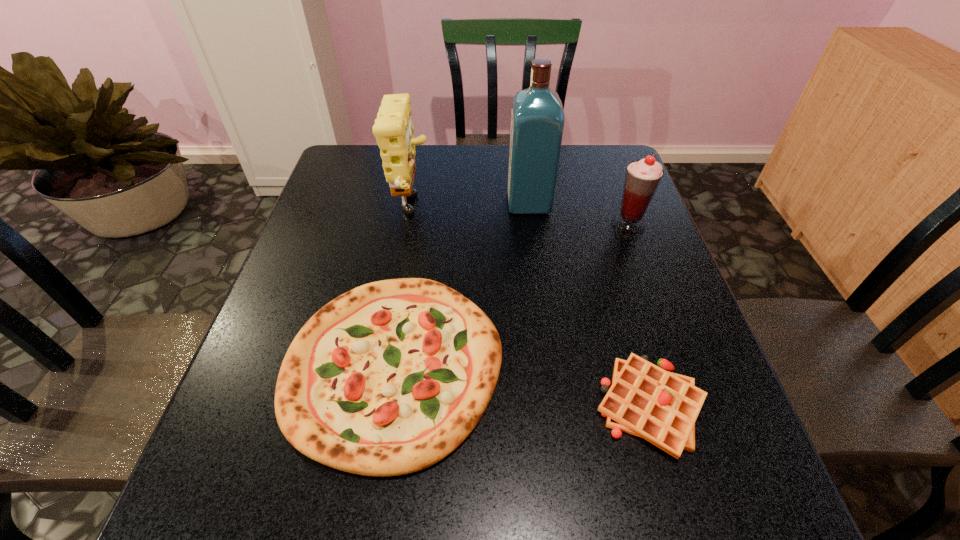
The image size is (960, 540). I want to click on the third object from right to left, so click(x=537, y=117).

Find the location of `the tallest object`. the tallest object is located at coordinates (537, 117).

At what (x,y) coordinates should I click in order to perform the action: click on sponge. Please return your answer as a coordinate pair (x, y). The height and width of the screenshot is (540, 960). Looking at the image, I should click on (394, 131).

The width and height of the screenshot is (960, 540). In order to click on smoothie in this screenshot , I will do `click(642, 177)`.

Where is `pizza`? Image resolution: width=960 pixels, height=540 pixels. pizza is located at coordinates (389, 378).

Locate an element on the screen. Image resolution: width=960 pixels, height=540 pixels. waffle is located at coordinates (644, 400).

Where is `vacant area located on the flat label side of the third object from right to left`? vacant area located on the flat label side of the third object from right to left is located at coordinates (366, 203).

Identify the location of free space located on the flat label side of the third object from right to left. Image resolution: width=960 pixels, height=540 pixels. (465, 203).

The width and height of the screenshot is (960, 540). I want to click on vacant space located 0.300m on the flat label side of the third object from right to left, so click(401, 203).

This screenshot has width=960, height=540. I want to click on free space located 0.300m on the face of the sponge, so click(x=540, y=210).